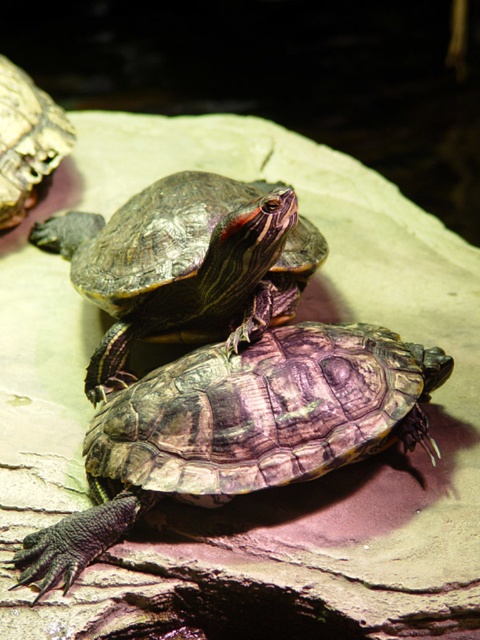
You are a photographer trying to capture both shiny brown tortoise at center and shiny brown tortoise at upper left in a single shot. Which tortoise will appear closer to the camera in the photo?

The shiny brown tortoise at center will appear closer to the camera because it is positioned in front of the shiny brown tortoise at upper left.

Looking at the scene with two turtles on a rock, which direction is the textured brown tortoise at center relative to the shiny brown tortoise at upper left?

The textured brown tortoise at center is located to the right of the shiny brown tortoise at upper left.

You are a small animal that is 0.5 meters long. You want to move from the shiny brown tortoise at upper left to the textured brown tortoise at center. Is there enough space for you to walk straight between them without touching either?

The distance between the textured brown tortoise at center and the shiny brown tortoise at upper left is 1.38 meters. Since the animal is 0.5 meters long, there is sufficient space for it to move straight between them without touching either.